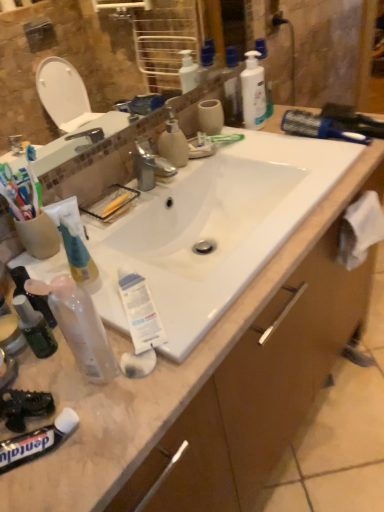
Question: Considering the relative sizes of white glossy bottle at upper right, the second cleaning product in the left-to-right sequence, and transparent plastic spray bottle at lower left, marked as the 2th toiletry in a top-to-bottom arrangement, in the image provided, is white glossy bottle at upper right, the second cleaning product in the left-to-right sequence, shorter than transparent plastic spray bottle at lower left, marked as the 2th toiletry in a top-to-bottom arrangement,?

Choices:
 (A) yes
 (B) no

Answer: (B)

Question: Is white glossy bottle at upper right, the second cleaning product in the left-to-right sequence, oriented away from transparent plastic spray bottle at lower left, the 1th toiletry from the front?

Choices:
 (A) no
 (B) yes

Answer: (A)

Question: Is white glossy bottle at upper right, acting as the 2th cleaning product starting from the front, outside of transparent plastic spray bottle at lower left, the 2th toiletry when ordered from right to left?

Choices:
 (A) yes
 (B) no

Answer: (A)

Question: From the image's perspective, is white glossy bottle at upper right, positioned as the 2th cleaning product in bottom-to-top order, on top of transparent plastic spray bottle at lower left, which is the first toiletry in left-to-right order?

Choices:
 (A) no
 (B) yes

Answer: (B)

Question: Is white glossy bottle at upper right, positioned as the first cleaning product in back-to-front order, to the right of transparent plastic spray bottle at lower left, marked as the 2th toiletry in a top-to-bottom arrangement, from the viewer's perspective?

Choices:
 (A) no
 (B) yes

Answer: (B)

Question: Is blue plastic brush at upper right spatially inside matte plastic soap dispenser at center, which is the 2th cleaning product in back-to-front order, or outside of it?

Choices:
 (A) outside
 (B) inside

Answer: (A)

Question: From the image's perspective, is blue plastic brush at upper right located above or below matte plastic soap dispenser at center, positioned as the 1th cleaning product in front-to-back order?

Choices:
 (A) above
 (B) below

Answer: (A)

Question: From a real-world perspective, relative to matte plastic soap dispenser at center, positioned as the 1th cleaning product in front-to-back order, is blue plastic brush at upper right vertically above or below?

Choices:
 (A) above
 (B) below

Answer: (B)

Question: In terms of size, does blue plastic brush at upper right appear bigger or smaller than matte plastic soap dispenser at center, marked as the second cleaning product in a top-to-bottom arrangement?

Choices:
 (A) small
 (B) big

Answer: (B)

Question: Is point (24, 300) positioned closer to the camera than point (294, 333)?

Choices:
 (A) closer
 (B) farther

Answer: (A)

Question: From a real-world perspective, relative to brown wood drawer at lower right, is translucent plastic mouthwash at lower left vertically above or below?

Choices:
 (A) below
 (B) above

Answer: (B)

Question: Is translucent plastic mouthwash at lower left inside or outside of brown wood drawer at lower right?

Choices:
 (A) inside
 (B) outside

Answer: (B)

Question: In terms of width, does translucent plastic mouthwash at lower left look wider or thinner when compared to brown wood drawer at lower right?

Choices:
 (A) thin
 (B) wide

Answer: (A)

Question: Considering the positions of point (362, 246) and point (243, 485), is point (362, 246) closer or farther from the camera than point (243, 485)?

Choices:
 (A) closer
 (B) farther

Answer: (B)

Question: Considering the positions of white fabric at right and brown wood drawer at lower right in the image, is white fabric at right bigger or smaller than brown wood drawer at lower right?

Choices:
 (A) big
 (B) small

Answer: (B)